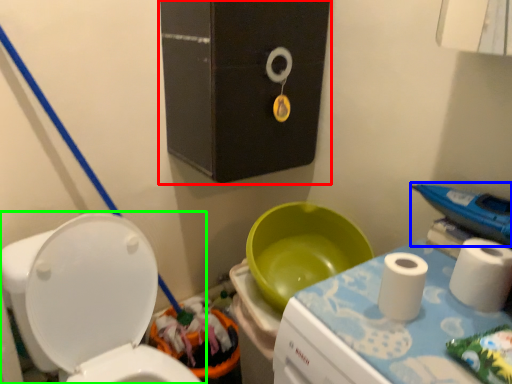
Question: Based on their relative distances, which object is farther from medicine cabinet (highlighted by a red box)? Choose from appliance (highlighted by a blue box) and toilet (highlighted by a green box).

Choices:
 (A) appliance
 (B) toilet

Answer: (A)